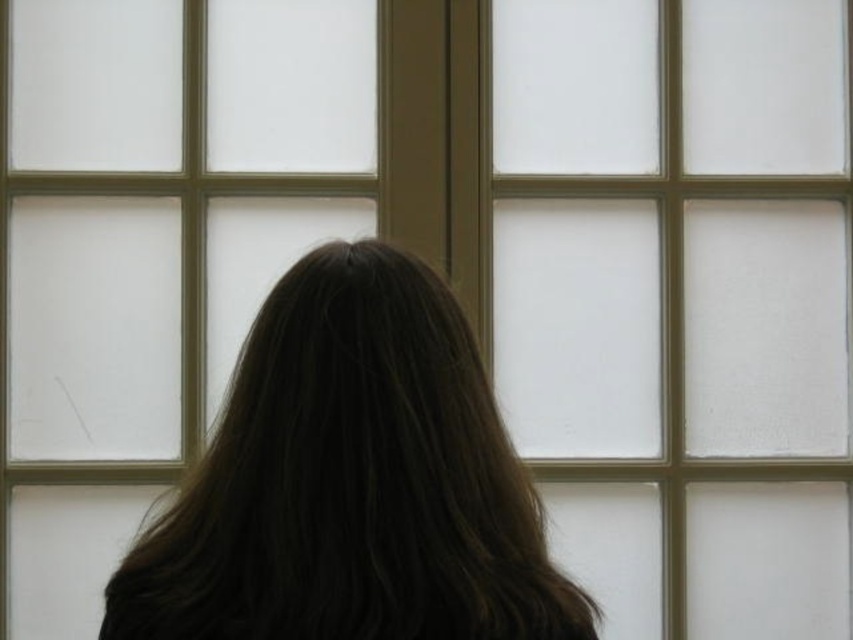
Is white frosted glass at center above brown hair at center?

Yes, white frosted glass at center is above brown hair at center.

Does white frosted glass at center have a larger size compared to brown hair at center?

Yes.

Which is behind, point (758, 502) or point (573, 625)?

The point (758, 502) is behind.

Locate an element on the screen. white frosted glass at center is located at coordinates (685, 284).